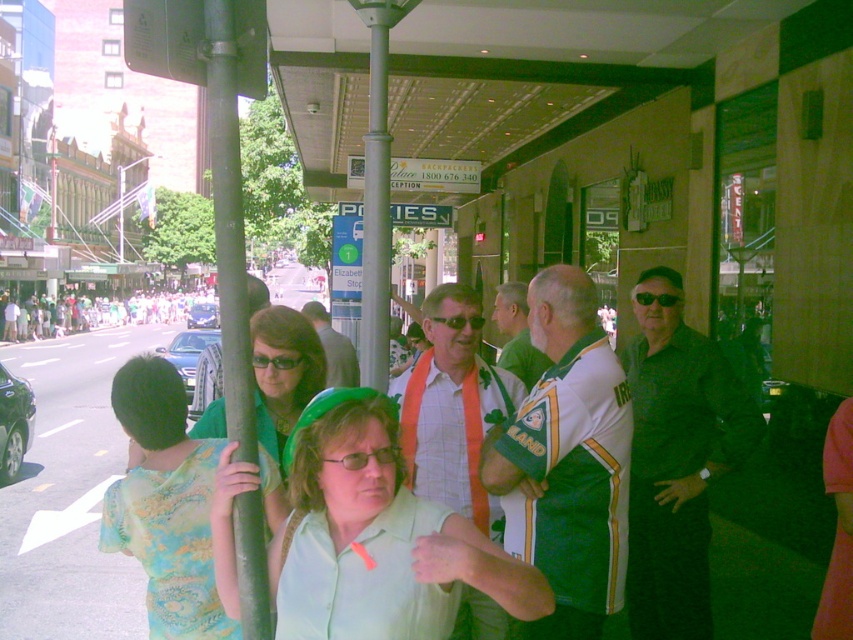
You are a photographer trying to capture a candid shot of both the black matte shirt at center and the plaid shirt at center. Since you want to ensure both are in focus, you need to know their vertical positions. Which one is lower in the frame?

The black matte shirt at center is below the plaid shirt at center, so the black matte shirt at center is lower in the frame.

You are a photographer trying to capture a group photo of the people at the bus stop. You notice the green jersey at center and the orange fabric shirt at center. Which clothing item is narrower in width?

The green jersey at center is thinner than the orange fabric shirt at center, so the green jersey at center is narrower in width.